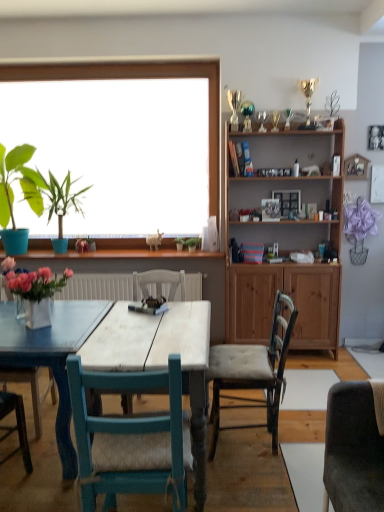
Question: Considering the positions of wooden cabinet at upper right and pink matte flower at window in the image, is wooden cabinet at upper right wider or thinner than pink matte flower at window?

Choices:
 (A) wide
 (B) thin

Answer: (A)

Question: From the image's perspective, relative to pink matte flower at window, is wooden cabinet at upper right above or below?

Choices:
 (A) above
 (B) below

Answer: (A)

Question: Estimate the real-world distances between objects in this image. Which object is farther from the matte blue pot at left, the third plant when ordered from right to left?

Choices:
 (A) green matte plant at center, placed as the 3th plant when sorted from left to right
 (B) white wood table at center
 (C) teal wood chair at center, positioned as the second chair in right-to-left order
 (D) green leafy plant at center, which is the second plant from left to right
 (E) wooden cabinet at upper right

Answer: (C)

Question: Which object is the closest to the pink matte flower at window?

Choices:
 (A) white wood table at center
 (B) green matte plant at center, placed as the 3th plant when sorted from left to right
 (C) wooden cabinet at upper right
 (D) white glossy vase at left
 (E) matte blue pot at left, the third plant when ordered from right to left

Answer: (E)